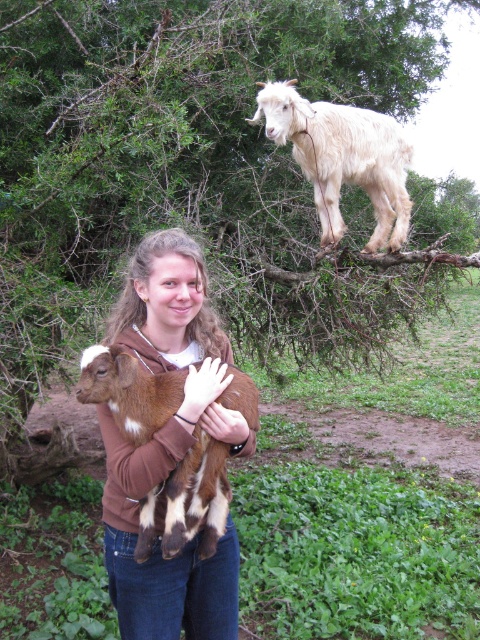
You are a photographer trying to focus your camera on the brown soft fur at center. What are the exact coordinates where you should adjust the focus to capture this part of the image?

The exact coordinates to focus on the brown soft fur at center are point (157, 547).

You are a photographer aiming to capture the white woolen goat at upper center in the center of your photo frame. Given its current position at point coordinates, can you estimate whether it is already centered or needs adjustment?

The white woolen goat at upper center is located at coordinates point (x=342, y=157), which is not the center of the frame. To center it, you would need to adjust the camera position or angle to move the goat towards the center coordinates.